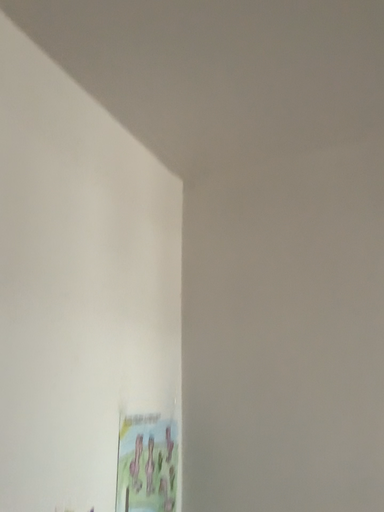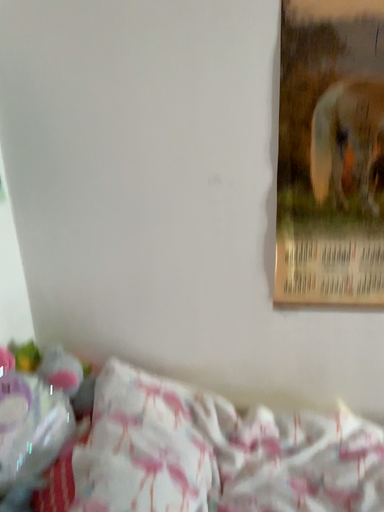
Question: Which way did the camera rotate in the video?

Choices:
 (A) rotated left
 (B) rotated right

Answer: (B)